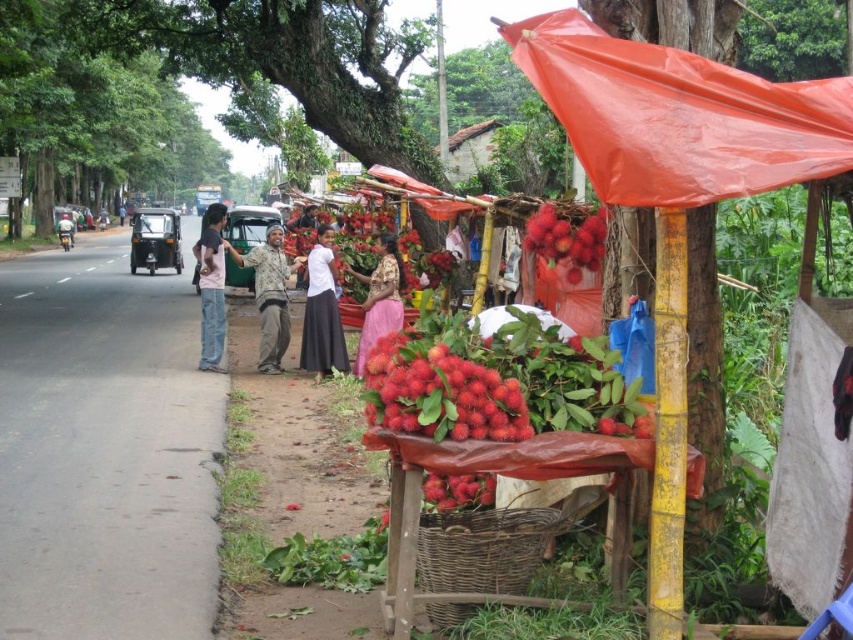
You are standing at the center of the image. Which direction should you look to see the orange plastic tarp at upper right?

The orange plastic tarp at upper right is located at point 0.183 on the x axis and 0.796 on the y axis, so you should look to the upper right direction to see it.